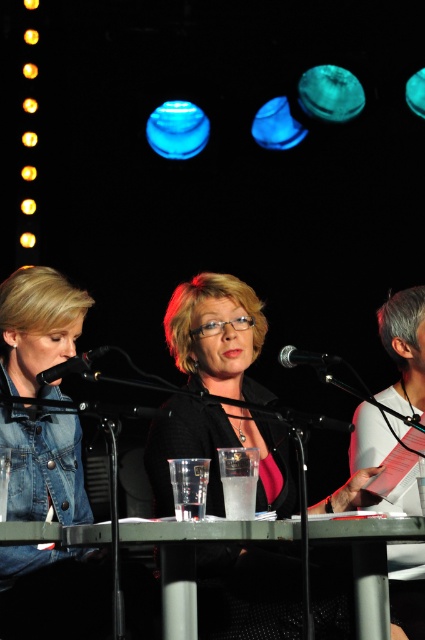
Question: Which object is the closest to the black metallic microphone at center?

Choices:
 (A) metallic gray table at center
 (B) black matte microphone at left
 (C) white paper at right

Answer: (B)

Question: Which point is closer to the camera taking this photo?

Choices:
 (A) (309, 355)
 (B) (48, 371)

Answer: (B)

Question: Is metallic gray table at center positioned behind black metallic microphone at center?

Choices:
 (A) no
 (B) yes

Answer: (A)

Question: Can you confirm if metallic gray table at center is positioned to the left of black metallic microphone at center?

Choices:
 (A) no
 (B) yes

Answer: (B)

Question: Does black matte microphone at left appear under black metallic microphone at center?

Choices:
 (A) yes
 (B) no

Answer: (A)

Question: Estimate the real-world distances between objects in this image. Which object is closer to the metallic gray table at center?

Choices:
 (A) black metallic microphone at center
 (B) white paper at right
 (C) black matte microphone at left

Answer: (A)